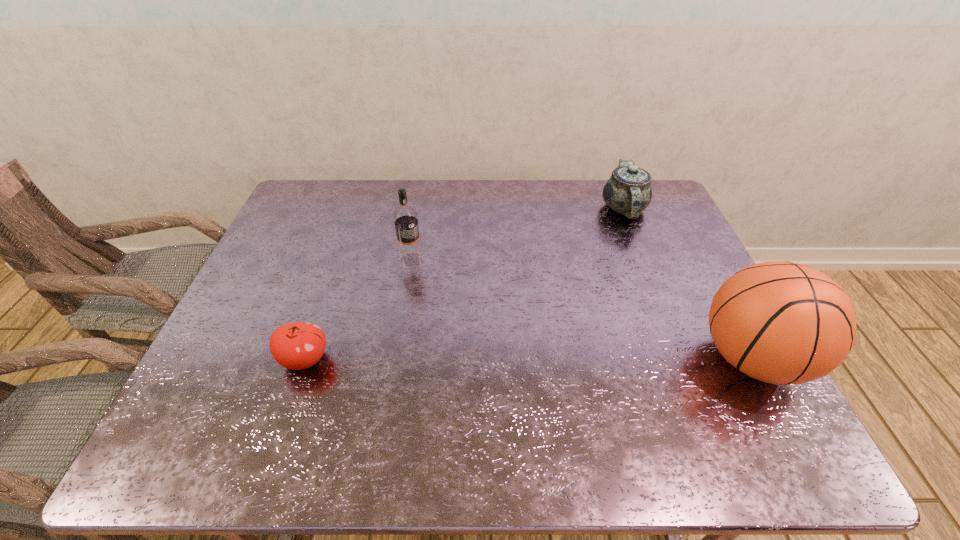
In order to click on empty location between the third tallest object and the basketball in this screenshot , I will do `click(687, 284)`.

The image size is (960, 540). What are the coordinates of `vacant space that is in between the basketball and the shortest object` in the screenshot? It's located at (529, 359).

At what (x,y) coordinates should I click in order to perform the action: click on free area in between the basketball and the vodka. Please return your answer as a coordinate pair (x, y). Looking at the image, I should click on (582, 309).

Where is `vacant area that lies between the vodka and the chinaware`? vacant area that lies between the vodka and the chinaware is located at coordinates (517, 234).

Where is `empty location between the chinaware and the basketball`? empty location between the chinaware and the basketball is located at coordinates (687, 284).

In order to click on free space between the second farthest object and the leftmost object in this screenshot , I will do `click(358, 309)`.

Find the location of a particular element. empty space that is in between the shortest object and the vodka is located at coordinates (358, 309).

You are a GUI agent. You are given a task and a screenshot of the screen. Output one action in this format:
    pyautogui.click(x=<x>, y=<y>)
    Task: Click on the vacant point located between the third nearest object and the basketball
    This screenshot has width=960, height=540.
    Given the screenshot: What is the action you would take?
    pyautogui.click(x=582, y=309)

In order to click on the second closest object to the third object from right to left in this screenshot , I will do `click(628, 191)`.

Identify which object is located as the nearest to the farthest object. Please provide its 2D coordinates. Your answer should be formatted as a tuple, i.e. [(x, y)], where the tuple contains the x and y coordinates of a point satisfying the conditions above.

[(780, 322)]